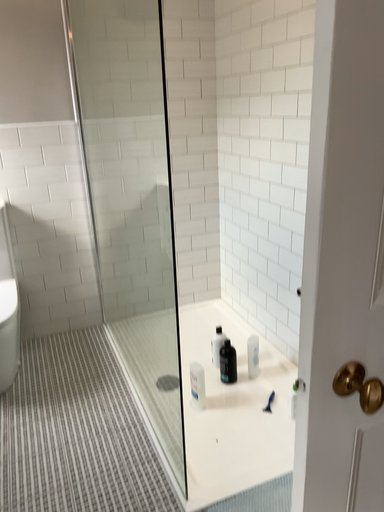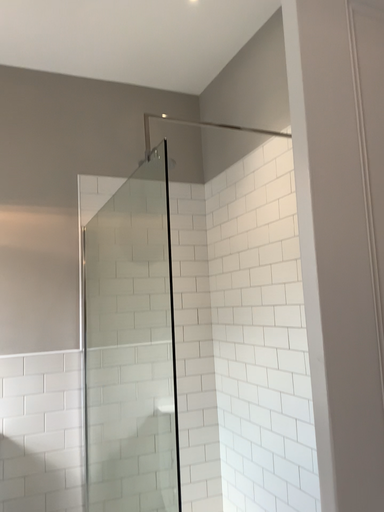
Question: Which way did the camera rotate in the video?

Choices:
 (A) rotated downward
 (B) rotated upward

Answer: (B)